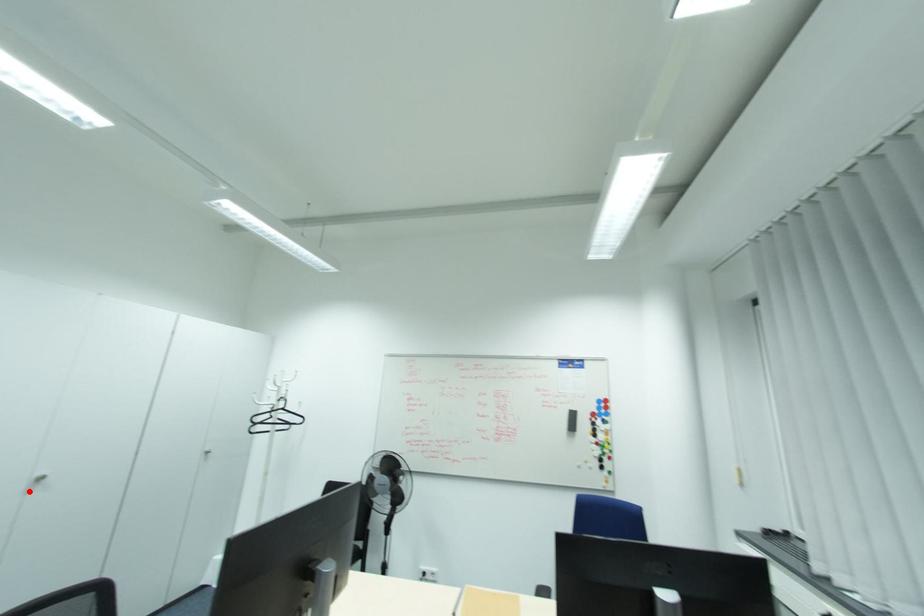
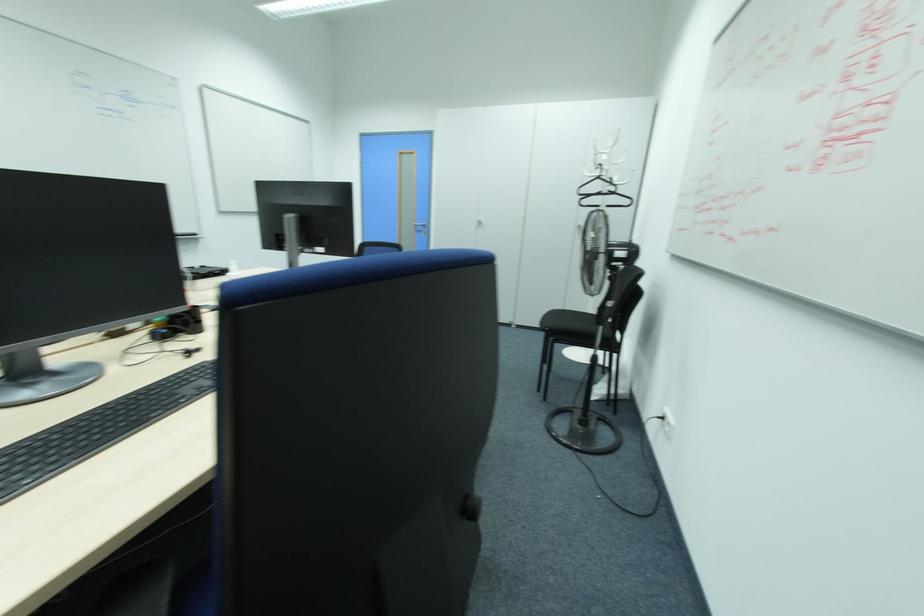
The point at the highlighted location is marked in the first image. Where is the corresponding point in the second image?

(479, 227)